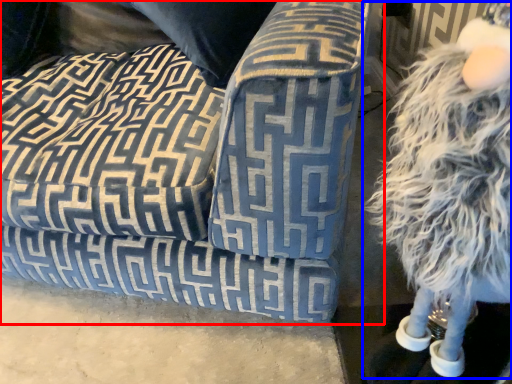
Question: Which object appears farthest to the camera in this image, studio couch (highlighted by a red box) or figurine (highlighted by a blue box)?

Choices:
 (A) studio couch
 (B) figurine

Answer: (A)